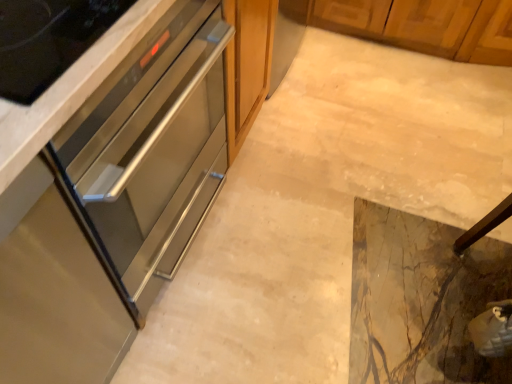
Question: Is stainless steel drawer at left, positioned as the first cabinetry in bottom-to-top order, aimed at marble tile floor at center?

Choices:
 (A) yes
 (B) no

Answer: (B)

Question: Can you confirm if stainless steel drawer at left, the 3th cabinetry from the top, is taller than marble tile floor at center?

Choices:
 (A) no
 (B) yes

Answer: (B)

Question: Is stainless steel drawer at left, positioned as the first cabinetry in bottom-to-top order, not near marble tile floor at center?

Choices:
 (A) no
 (B) yes

Answer: (A)

Question: Is stainless steel drawer at left, the 3th cabinetry from the top, directly adjacent to marble tile floor at center?

Choices:
 (A) no
 (B) yes

Answer: (A)

Question: Is stainless steel drawer at left, the 3th cabinetry from the top, closer to the viewer compared to marble tile floor at center?

Choices:
 (A) yes
 (B) no

Answer: (A)

Question: Is stainless steel drawer at left, the 3th cabinetry from the top, outside marble tile floor at center?

Choices:
 (A) yes
 (B) no

Answer: (A)

Question: Does stainless steel oven at left, which is the second cabinetry from bottom to top, have a greater width compared to marble tile floor at center?

Choices:
 (A) no
 (B) yes

Answer: (A)

Question: Does stainless steel oven at left, which is the second cabinetry from bottom to top, have a smaller size compared to marble tile floor at center?

Choices:
 (A) yes
 (B) no

Answer: (B)

Question: Is the position of stainless steel oven at left, positioned as the 2th cabinetry in top-to-bottom order, more distant than that of marble tile floor at center?

Choices:
 (A) yes
 (B) no

Answer: (B)

Question: Would you say stainless steel oven at left, which is the second cabinetry from bottom to top, is outside marble tile floor at center?

Choices:
 (A) no
 (B) yes

Answer: (B)

Question: From a real-world perspective, is stainless steel oven at left, positioned as the 2th cabinetry in top-to-bottom order, located higher than marble tile floor at center?

Choices:
 (A) no
 (B) yes

Answer: (B)

Question: From the image's perspective, is stainless steel oven at left, positioned as the 2th cabinetry in top-to-bottom order, above marble tile floor at center?

Choices:
 (A) no
 (B) yes

Answer: (B)

Question: From a real-world perspective, is stainless steel oven at center, acting as the 3th cabinetry starting from the bottom, over stainless steel oven at left, positioned as the 2th cabinetry in top-to-bottom order?

Choices:
 (A) no
 (B) yes

Answer: (A)